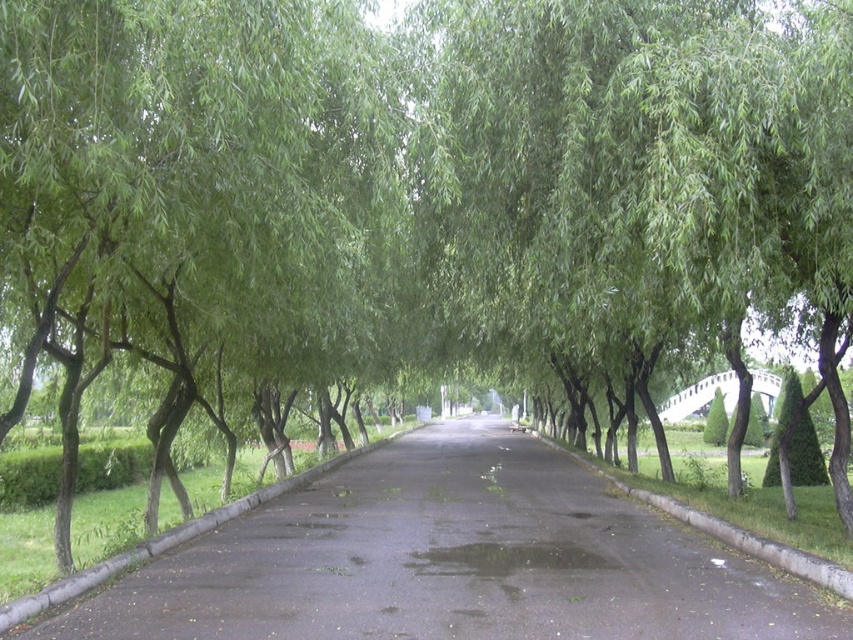
Does black asphalt road at center appear under gray concrete curb at lower right?

No.

Can you confirm if black asphalt road at center is wider than gray concrete curb at lower right?

Yes.

Who is more forward, (675, 541) or (729, 531)?

Positioned in front is point (729, 531).

Locate an element on the screen. The width and height of the screenshot is (853, 640). black asphalt road at center is located at coordinates (451, 561).